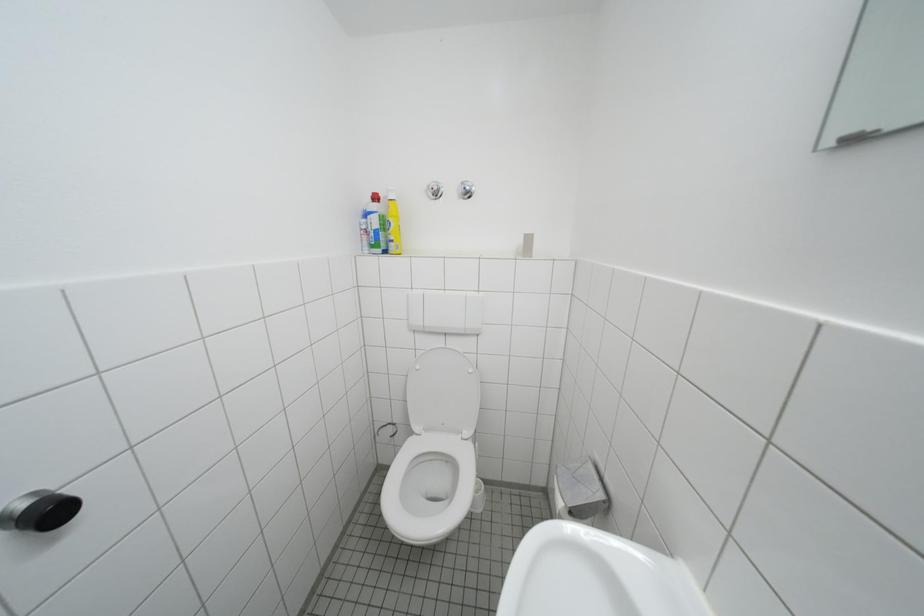
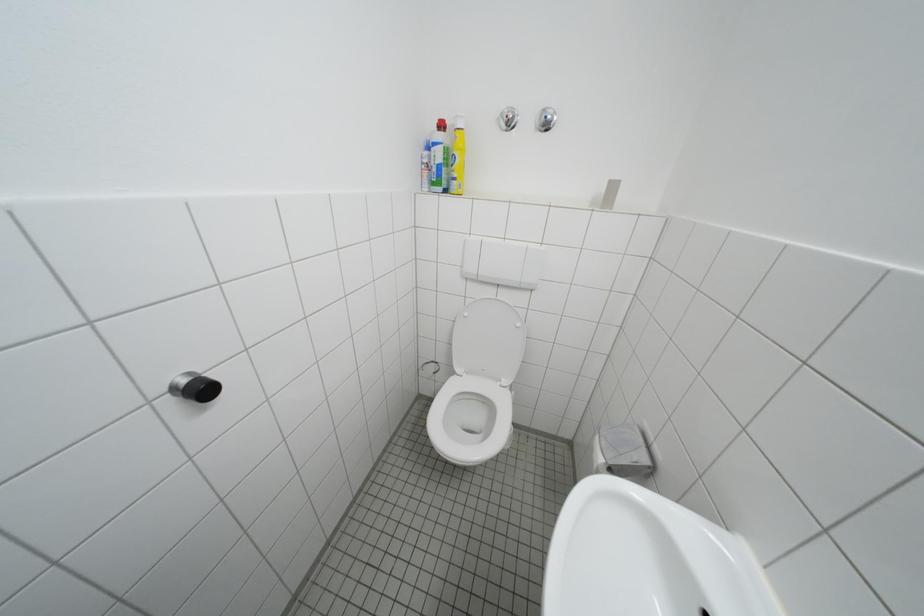
Question: The images are taken continuously from a first-person perspective. In which direction are you moving?

Choices:
 (A) Left
 (B) Right
 (C) Forward
 (D) Backward

Answer: (A)